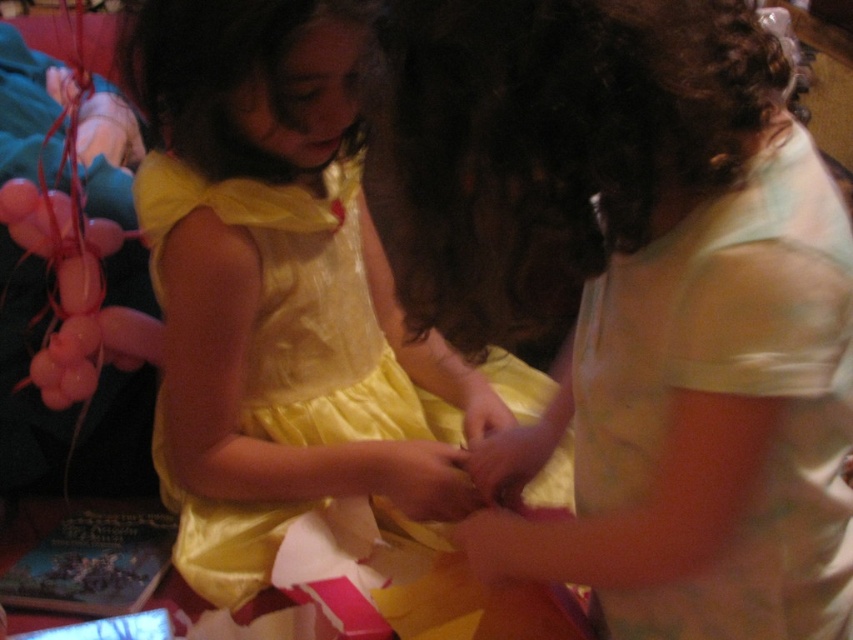
Question: Is light green fabric shirt at center closer to camera compared to yellow satin dress at center?

Choices:
 (A) no
 (B) yes

Answer: (B)

Question: Which point appears farthest from the camera in this image?

Choices:
 (A) (628, 218)
 (B) (173, 4)

Answer: (B)

Question: Can you confirm if light green fabric shirt at center is wider than yellow satin dress at center?

Choices:
 (A) no
 (B) yes

Answer: (A)

Question: Which of the following is the farthest from the observer?

Choices:
 (A) tap(514, 438)
 (B) tap(303, 184)

Answer: (B)

Question: Among these points, which one is nearest to the camera?

Choices:
 (A) (323, 38)
 (B) (473, 136)

Answer: (B)

Question: Can you confirm if light green fabric shirt at center is thinner than yellow satin dress at center?

Choices:
 (A) no
 (B) yes

Answer: (B)